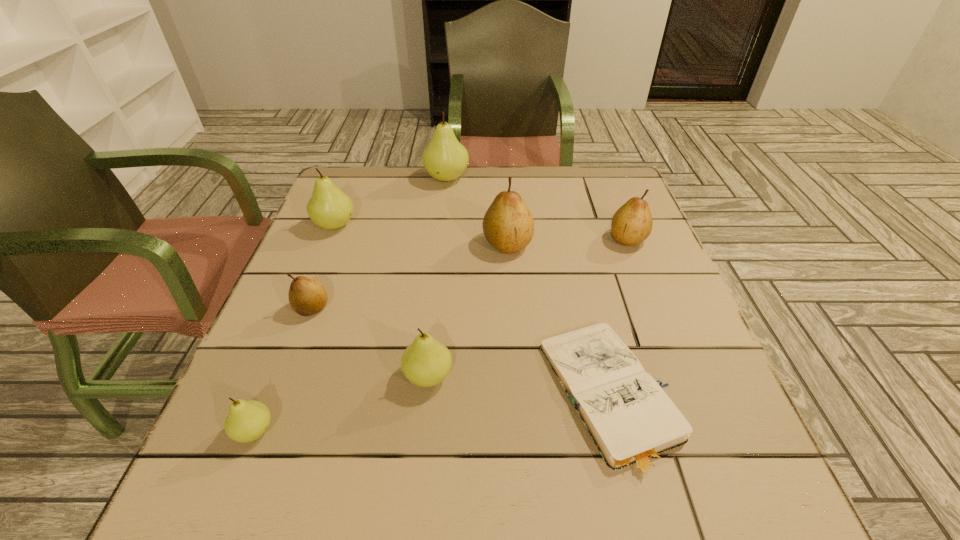
The width and height of the screenshot is (960, 540). What are the coordinates of `vacant region located on the right of the nearest pear` in the screenshot? It's located at (476, 431).

Identify the location of blank space located on the left of the shortest object. (363, 397).

Find the location of a particular element. object located in the far edge section of the desktop is located at coordinates (444, 158).

Locate an element on the screen. The width and height of the screenshot is (960, 540). object that is at the near edge is located at coordinates (633, 423).

Find the location of `pear at the right edge`. pear at the right edge is located at coordinates (632, 223).

Identify the location of notebook that is positioned at the right edge. (633, 423).

Find the location of a particular element. The width and height of the screenshot is (960, 540). object at the near right corner is located at coordinates (633, 423).

At what (x,y) coordinates should I click in order to perform the action: click on vacant region at the far edge. Please return your answer as a coordinate pair (x, y). This screenshot has width=960, height=540. Looking at the image, I should click on (398, 179).

Find the location of a particular element. This screenshot has width=960, height=540. free location at the near edge is located at coordinates tap(483, 515).

You are a GUI agent. You are given a task and a screenshot of the screen. Output one action in this format:
    pyautogui.click(x=<x>, y=<y>)
    Task: Click on the vacant space at the left edge
    The width and height of the screenshot is (960, 540).
    Given the screenshot: What is the action you would take?
    pyautogui.click(x=256, y=451)